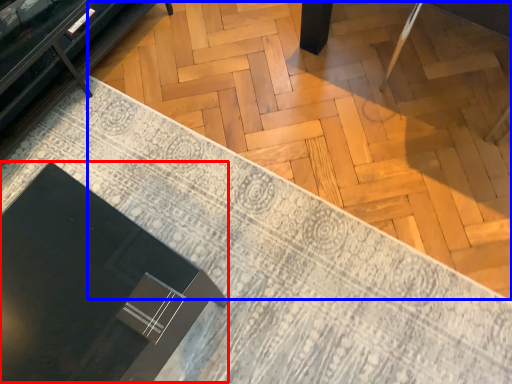
Question: Among these objects, which one is nearest to the camera, round table (highlighted by a red box) or plywood (highlighted by a blue box)?

Choices:
 (A) round table
 (B) plywood

Answer: (A)